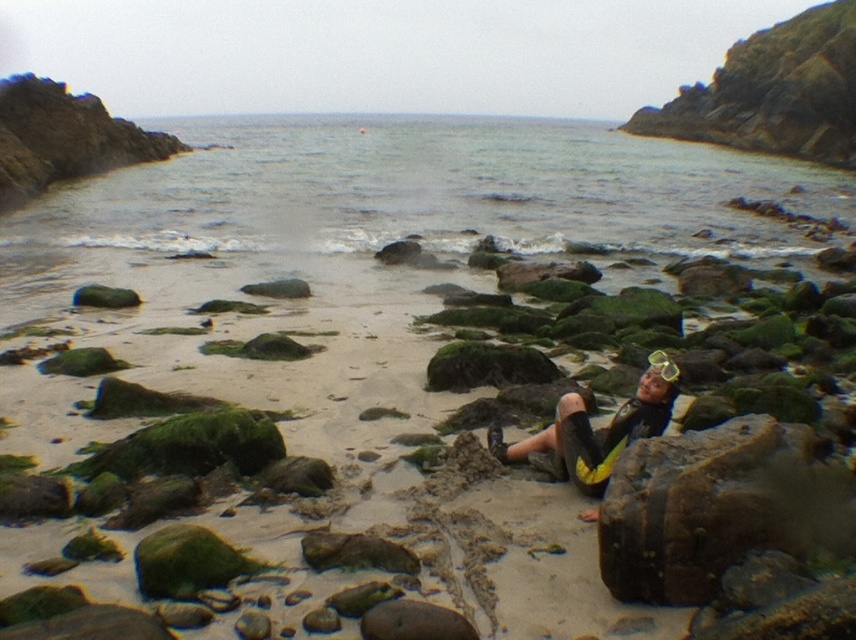
You are a photographer trying to capture the yellow matte goggles at center in your shot. There is a green mossy rock at center blocking the view. Can you move the rock to get a clear photo of the goggles?

The green mossy rock at center is located above the yellow matte goggles at center, so moving the rock would allow you to see the goggles underneath.

You are a lifeguard on duty and need to quickly assess the location of the snorkeler. Based on the scene, which object is positioned lower down between the yellow neoprene wetsuit at center and the yellow matte goggles at center?

The yellow neoprene wetsuit at center is positioned lower than the yellow matte goggles at center.

You are standing at a point behind both point (456, 572) and point (672, 358). If you want to see the point that is closer to you, which one would it be?

Point (672, 358) is behind point (456, 572), so the point closer to you would be point (456, 572).